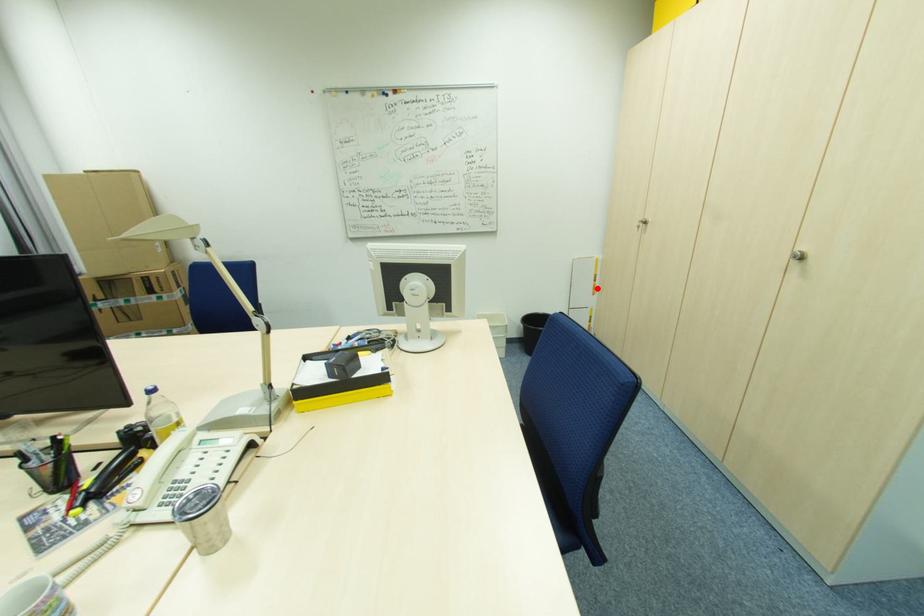
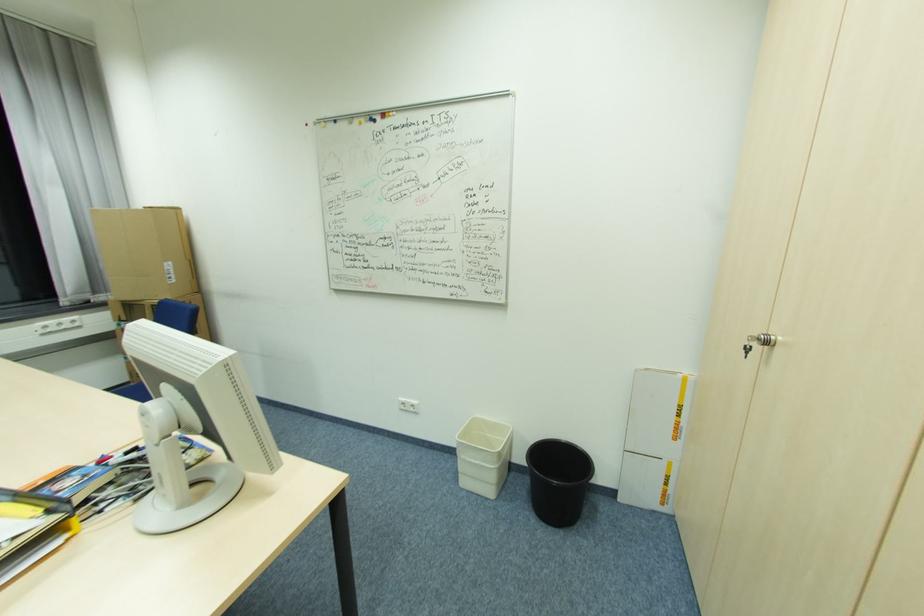
Find the pixel in the second image that matches the highlighted location in the first image.

(681, 430)